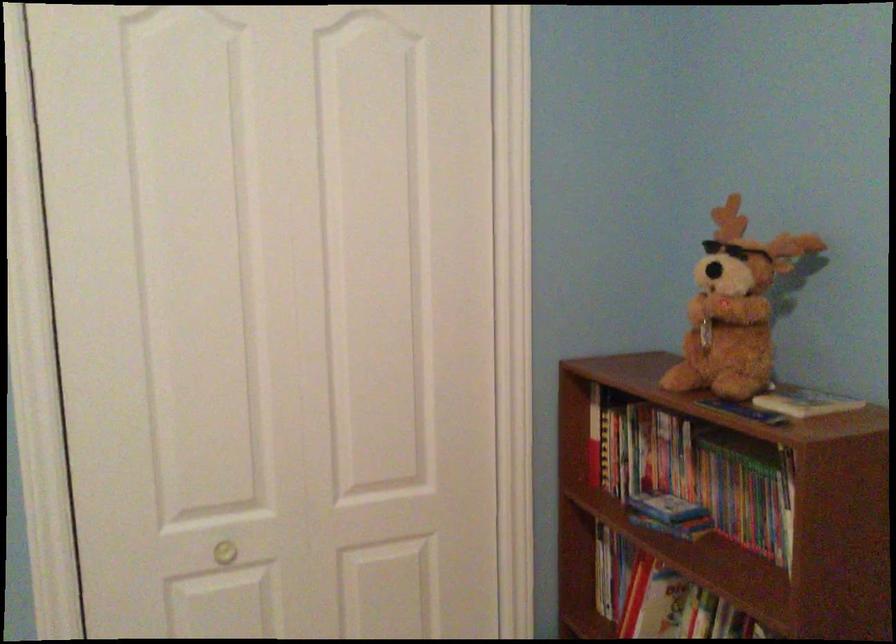
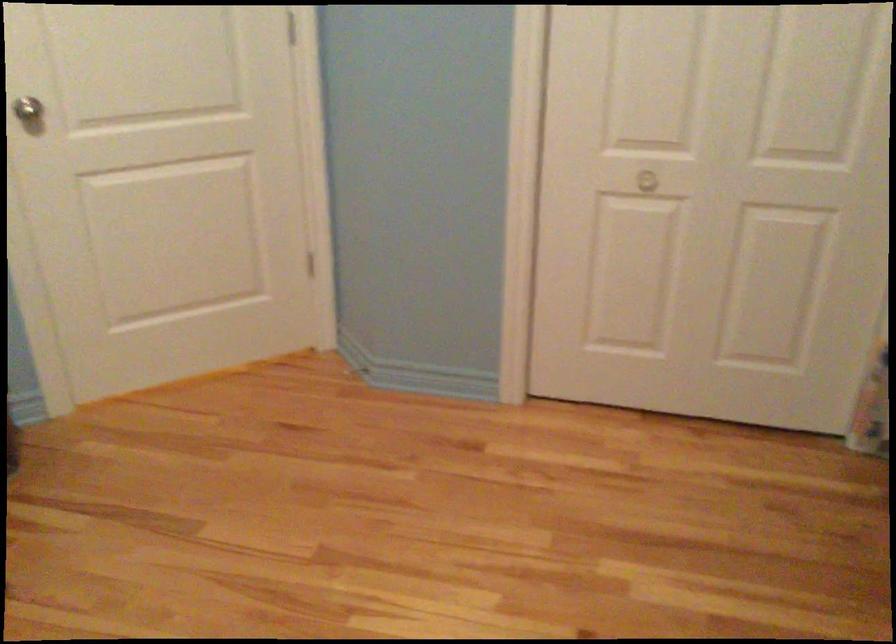
Locate, in the second image, the point that corresponds to point (235, 551) in the first image.

(658, 176)